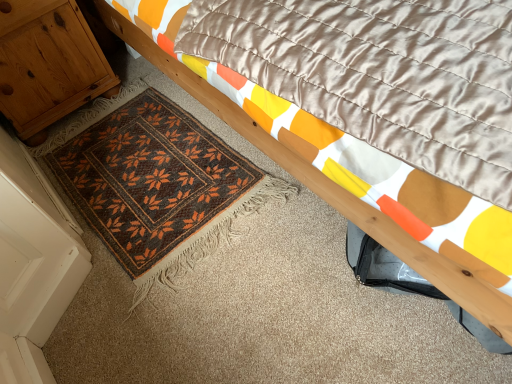
What is the approximate width of wooden cabinet at left?

wooden cabinet at left is 43.47 centimeters in width.

The height and width of the screenshot is (384, 512). Identify the location of wooden bed frame at upper right. (x=330, y=188).

What is the approximate height of brown woven mat at lower left?

brown woven mat at lower left is 1.47 inches in height.

Where is `wooden cabinet at left`? The image size is (512, 384). wooden cabinet at left is located at coordinates (47, 63).

Is point (294, 171) closer or farther from the camera than point (82, 115)?

Point (294, 171) is positioned closer to the camera compared to point (82, 115).

Considering their positions, is wooden bed frame at upper right located in front of or behind brown woven mat at lower left?

Clearly, wooden bed frame at upper right is in front of brown woven mat at lower left.

Looking at the image, does wooden bed frame at upper right seem bigger or smaller compared to brown woven mat at lower left?

Considering their sizes, wooden bed frame at upper right takes up more space than brown woven mat at lower left.

Where is `bed above the brown woven mat at lower left (from a real-world perspective)`? The image size is (512, 384). bed above the brown woven mat at lower left (from a real-world perspective) is located at coordinates 330,188.

Can you tell me how much wooden bed frame at upper right and wooden cabinet at left differ in facing direction?

They differ by 0.7 degrees in their facing directions.

Between wooden bed frame at upper right and wooden cabinet at left, which one has larger width?

With larger width is wooden bed frame at upper right.

Can you confirm if wooden bed frame at upper right is shorter than wooden cabinet at left?

In fact, wooden bed frame at upper right may be taller than wooden cabinet at left.

Considering the relative positions of wooden bed frame at upper right and wooden cabinet at left in the image provided, is wooden bed frame at upper right in front of wooden cabinet at left?

Yes, wooden bed frame at upper right is in front of wooden cabinet at left.

From the image's perspective, who appears lower, brown woven mat at lower left or wooden bed frame at upper right?

brown woven mat at lower left, from the image's perspective.

From a real-world perspective, which object stands above the other?

wooden bed frame at upper right.

Which is in front, brown woven mat at lower left or wooden bed frame at upper right?

wooden bed frame at upper right is in front.

Is brown woven mat at lower left looking in the opposite direction of wooden bed frame at upper right?

brown woven mat at lower left is not turned away from wooden bed frame at upper right.

The height and width of the screenshot is (384, 512). Identify the location of cabinetry on the left of brown woven mat at lower left. (47, 63).

From the image's perspective, which one is positioned lower, brown woven mat at lower left or wooden cabinet at left?

From the image's view, brown woven mat at lower left is below.

Is brown woven mat at lower left bigger or smaller than wooden cabinet at left?

In the image, brown woven mat at lower left appears to be smaller than wooden cabinet at left.

Is brown woven mat at lower left located outside wooden cabinet at left?

brown woven mat at lower left is positioned outside wooden cabinet at left.

You are a GUI agent. You are given a task and a screenshot of the screen. Output one action in this format:
    pyautogui.click(x=<x>, y=<y>)
    Task: Click on the mat that is under the wooden cabinet at left (from a real-world perspective)
    This screenshot has width=512, height=384.
    Given the screenshot: What is the action you would take?
    pyautogui.click(x=155, y=184)

Is wooden cabinet at left positioned far away from brown woven mat at lower left?

No, wooden cabinet at left is in close proximity to brown woven mat at lower left.

Between wooden cabinet at left and brown woven mat at lower left, which one appears on the left side from the viewer's perspective?

wooden cabinet at left is more to the left.

Which is closer, (11, 70) or (55, 167)?

Clearly, point (11, 70) is closer to the camera than point (55, 167).

Can you confirm if wooden cabinet at left is taller than wooden bed frame at upper right?

No, wooden cabinet at left is not taller than wooden bed frame at upper right.

From the image's perspective, relative to wooden bed frame at upper right, is wooden cabinet at left above or below?

wooden cabinet at left is situated higher than wooden bed frame at upper right in the image.

Is wooden cabinet at left to the left of wooden bed frame at upper right from the viewer's perspective?

Correct, you'll find wooden cabinet at left to the left of wooden bed frame at upper right.

Find the location of a particular element. The width and height of the screenshot is (512, 384). bed above the brown woven mat at lower left (from the image's perspective) is located at coordinates (330, 188).

The width and height of the screenshot is (512, 384). I want to click on bed below the wooden cabinet at left (from the image's perspective), so click(x=330, y=188).

Based on their spatial positions, is wooden cabinet at left or brown woven mat at lower left further from wooden bed frame at upper right?

wooden cabinet at left lies further to wooden bed frame at upper right than the other object.

Considering their positions, is wooden bed frame at upper right positioned closer to wooden cabinet at left than brown woven mat at lower left?

Among the two, brown woven mat at lower left is located nearer to wooden cabinet at left.

When comparing their distances from brown woven mat at lower left, does wooden cabinet at left or wooden bed frame at upper right seem closer?

wooden cabinet at left lies closer to brown woven mat at lower left than the other object.

Based on their spatial positions, is wooden bed frame at upper right or wooden cabinet at left further from brown woven mat at lower left?

wooden bed frame at upper right lies further to brown woven mat at lower left than the other object.

Looking at the image, which one is located further to wooden cabinet at left, brown woven mat at lower left or wooden bed frame at upper right?

wooden bed frame at upper right is positioned further to the anchor wooden cabinet at left.

When comparing their distances from wooden bed frame at upper right, does brown woven mat at lower left or wooden cabinet at left seem closer?

Among the two, brown woven mat at lower left is located nearer to wooden bed frame at upper right.

Where is `mat located between wooden cabinet at left and wooden bed frame at upper right in the left-right direction`? Image resolution: width=512 pixels, height=384 pixels. mat located between wooden cabinet at left and wooden bed frame at upper right in the left-right direction is located at coordinates (155, 184).